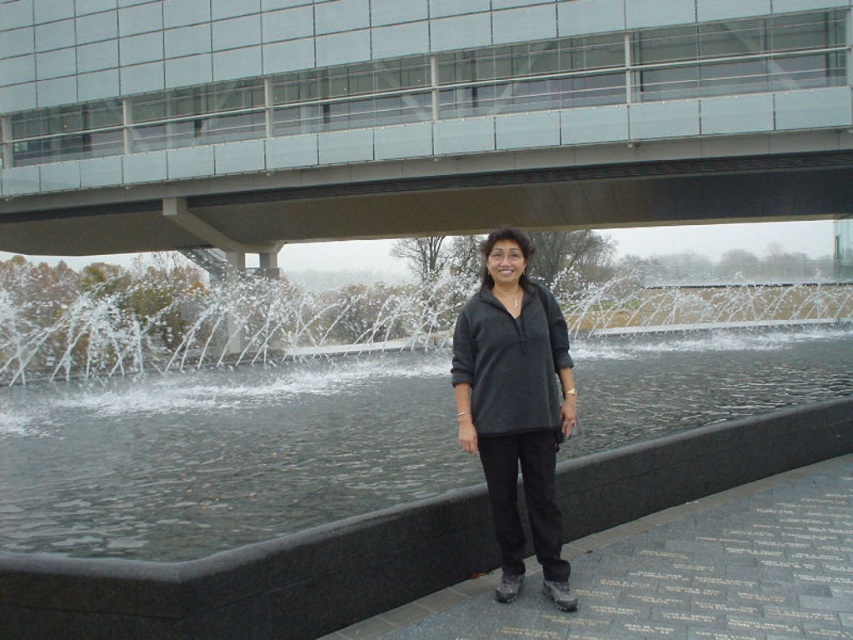
Can you confirm if clear water at center is bigger than dark gray fleece at center?

Yes, clear water at center is bigger than dark gray fleece at center.

Between clear water at center and dark gray fleece at center, which one is positioned higher?

Positioned higher is clear water at center.

This screenshot has width=853, height=640. In order to click on clear water at center in this screenshot , I will do `click(222, 454)`.